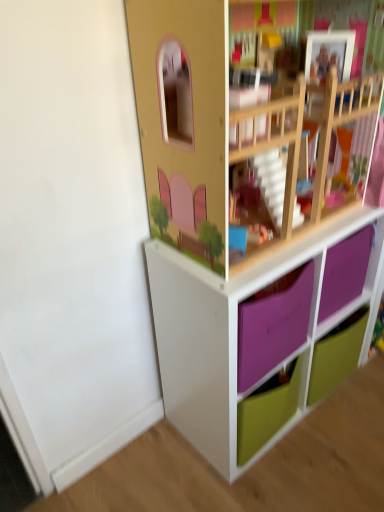
Question: From their relative heights in the image, would you say green matte drawer at lower right is taller or shorter than white matte storage unit at lower right?

Choices:
 (A) tall
 (B) short

Answer: (B)

Question: Considering the relative positions of green matte drawer at lower right and white matte storage unit at lower right in the image provided, is green matte drawer at lower right to the left or to the right of white matte storage unit at lower right?

Choices:
 (A) right
 (B) left

Answer: (A)

Question: Is green matte drawer at lower right wider or thinner than white matte storage unit at lower right?

Choices:
 (A) thin
 (B) wide

Answer: (A)

Question: From their relative heights in the image, would you say white matte storage unit at lower right is taller or shorter than green matte drawer at lower right?

Choices:
 (A) short
 (B) tall

Answer: (B)

Question: In terms of width, does white matte storage unit at lower right look wider or thinner when compared to green matte drawer at lower right?

Choices:
 (A) wide
 (B) thin

Answer: (A)

Question: From a real-world perspective, is white matte storage unit at lower right above or below green matte drawer at lower right?

Choices:
 (A) above
 (B) below

Answer: (A)

Question: Is white matte storage unit at lower right spatially inside green matte drawer at lower right, or outside of it?

Choices:
 (A) outside
 (B) inside

Answer: (A)